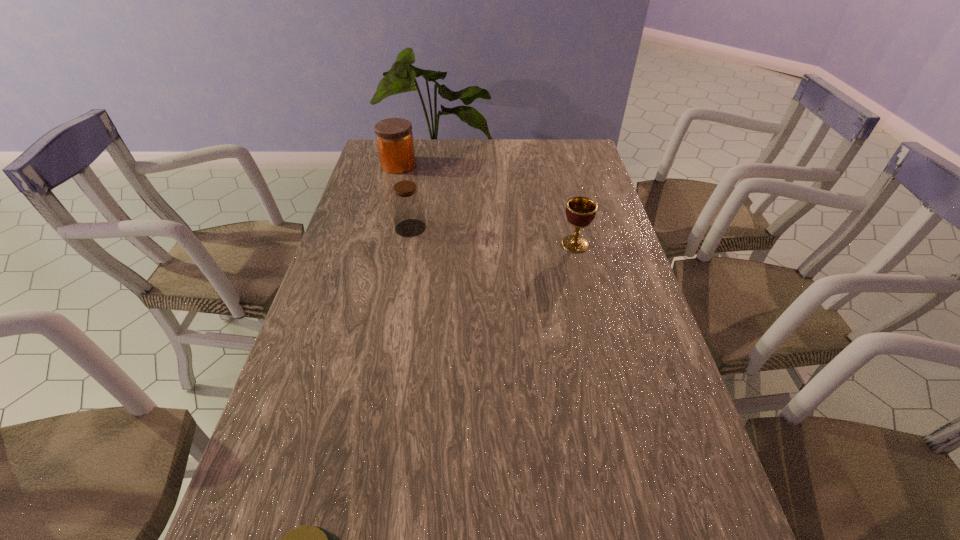
Locate an element on the screen. The width and height of the screenshot is (960, 540). free point at the far edge is located at coordinates (516, 147).

The image size is (960, 540). Identify the location of free space at the left edge of the desktop. (327, 481).

In the image, there is a desktop. What are the coordinates of `vacant space at the right edge` in the screenshot? It's located at (618, 288).

Where is `vacant area that lies between the chalice and the farthest object`? The width and height of the screenshot is (960, 540). vacant area that lies between the chalice and the farthest object is located at coordinates (487, 205).

Locate an element on the screen. The width and height of the screenshot is (960, 540). vacant region between the rightmost object and the farthest jar is located at coordinates (487, 205).

Find the location of a particular element. object that is the nearest to the farthest object is located at coordinates (407, 205).

Choose which object is the second nearest neighbor to the rightmost object. Please provide its 2D coordinates. Your answer should be formatted as a tuple, i.e. [(x, y)], where the tuple contains the x and y coordinates of a point satisfying the conditions above.

[(394, 136)]

Identify which jar is the third nearest to the rightmost object. Please provide its 2D coordinates. Your answer should be formatted as a tuple, i.e. [(x, y)], where the tuple contains the x and y coordinates of a point satisfying the conditions above.

[(306, 539)]

Identify which jar is the nearest to the nearest object. Please provide its 2D coordinates. Your answer should be formatted as a tuple, i.e. [(x, y)], where the tuple contains the x and y coordinates of a point satisfying the conditions above.

[(407, 205)]